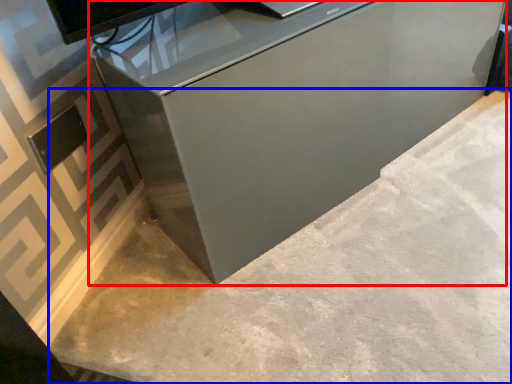
Question: Which of the following is the closest to the observer, furniture (highlighted by a red box) or concrete (highlighted by a blue box)?

Choices:
 (A) furniture
 (B) concrete

Answer: (B)